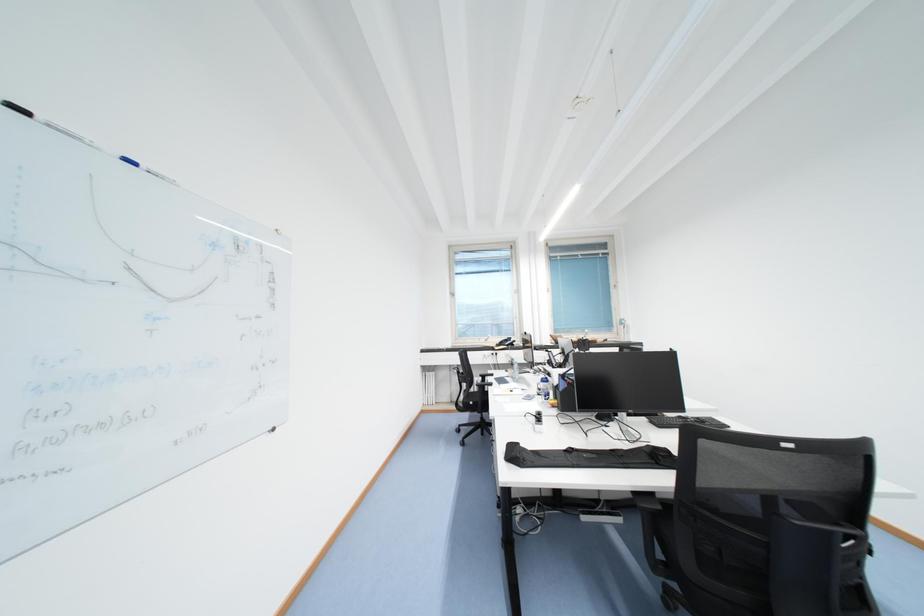
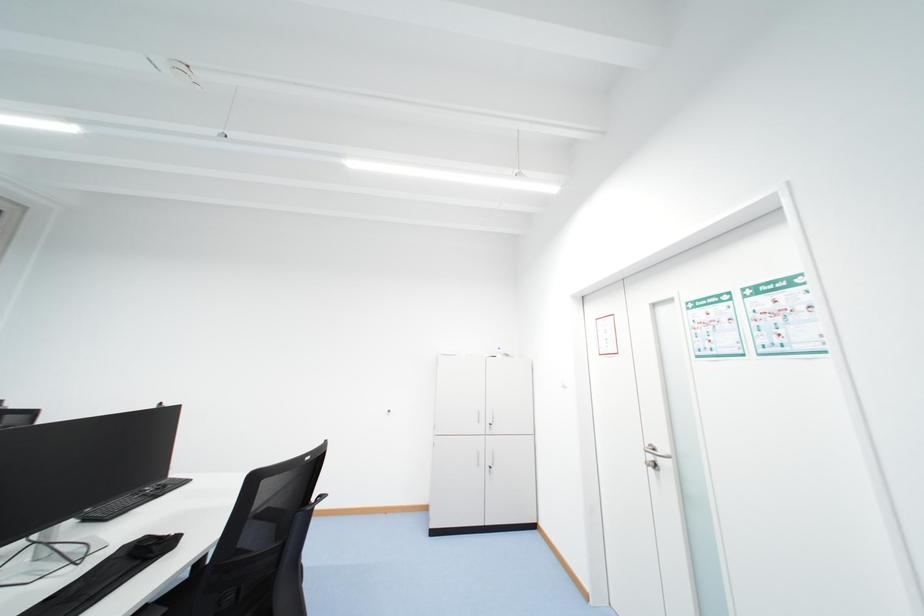
The images are taken continuously from a first-person perspective. In which direction is your viewpoint rotating?

The rotation direction of the camera is right-up.